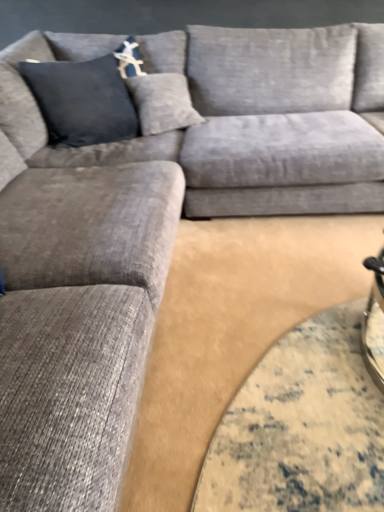
Question: In terms of height, does dark blue fabric pillow at upper left look taller or shorter compared to textured gray couch at center?

Choices:
 (A) short
 (B) tall

Answer: (A)

Question: From the image's perspective, relative to textured gray couch at center, is dark blue fabric pillow at upper left above or below?

Choices:
 (A) above
 (B) below

Answer: (A)

Question: Which is correct: dark blue fabric pillow at upper left is inside textured gray couch at center, or outside of it?

Choices:
 (A) inside
 (B) outside

Answer: (B)

Question: From a real-world perspective, is textured gray couch at center physically located above or below dark blue fabric pillow at upper left?

Choices:
 (A) below
 (B) above

Answer: (A)

Question: In terms of height, does textured gray couch at center look taller or shorter compared to dark blue fabric pillow at upper left?

Choices:
 (A) tall
 (B) short

Answer: (A)

Question: Is textured gray couch at center inside or outside of dark blue fabric pillow at upper left?

Choices:
 (A) inside
 (B) outside

Answer: (B)

Question: Is point (296, 158) positioned closer to the camera than point (180, 65)?

Choices:
 (A) closer
 (B) farther

Answer: (A)